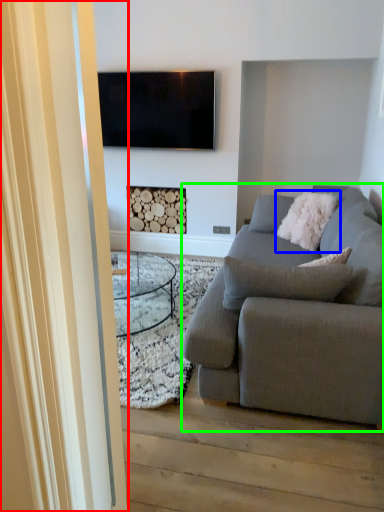
Question: Which is farther away from glass door (highlighted by a red box)? pillow (highlighted by a blue box) or studio couch (highlighted by a green box)?

Choices:
 (A) pillow
 (B) studio couch

Answer: (A)